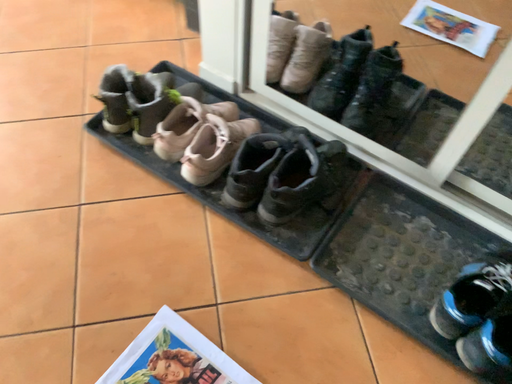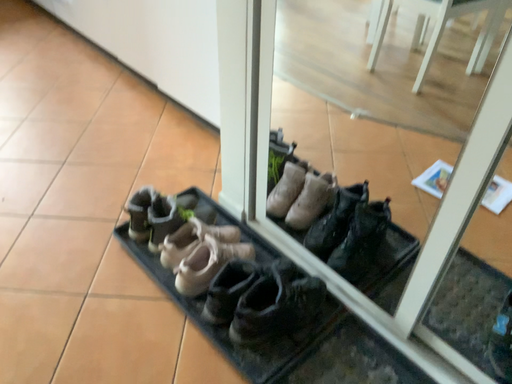
Question: How did the camera likely rotate when shooting the video?

Choices:
 (A) rotated right
 (B) rotated left

Answer: (B)